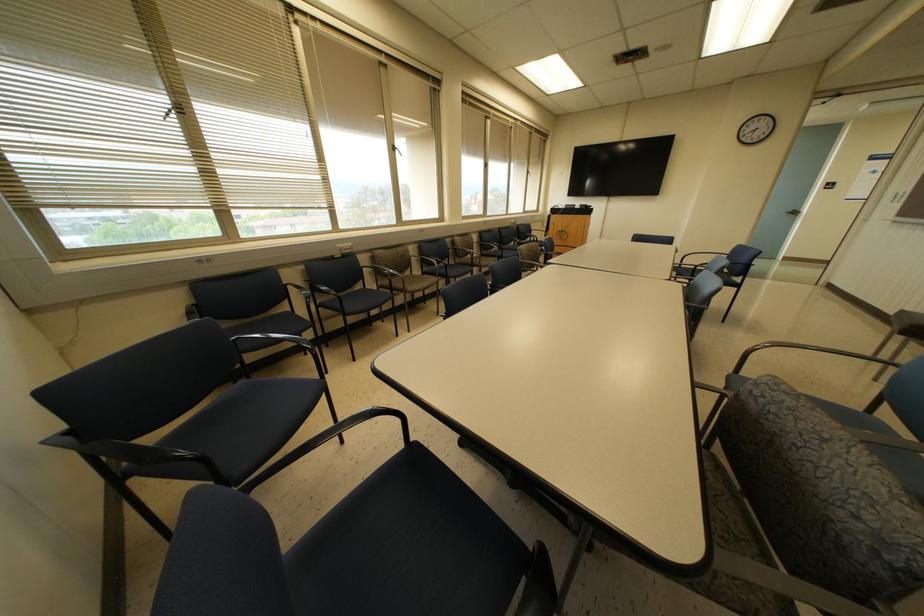
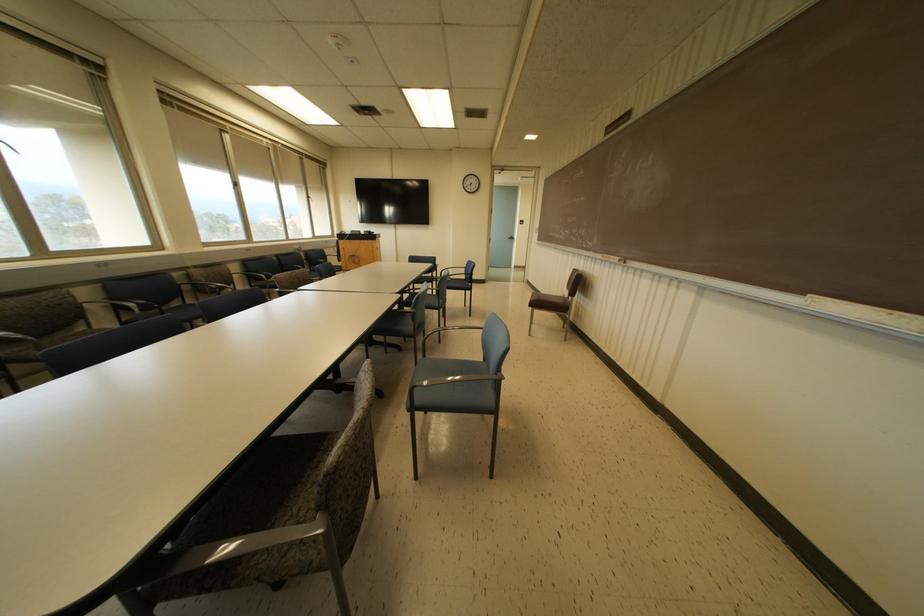
The point at (795, 212) is marked in the first image. Where is the corresponding point in the second image?

(512, 238)